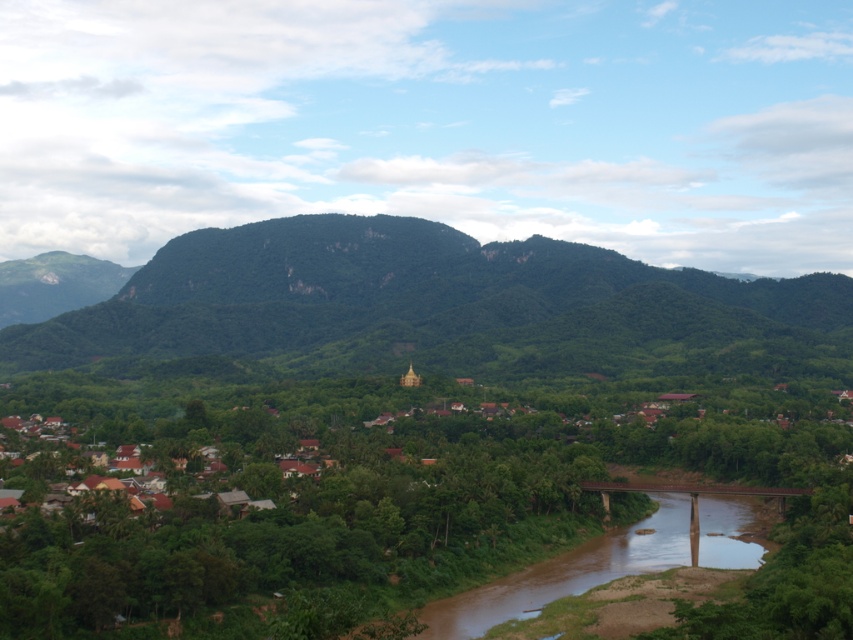
Is green forested mountain at center below brown muddy water at center?

Actually, green forested mountain at center is above brown muddy water at center.

This screenshot has width=853, height=640. Find the location of `green forested mountain at center`. green forested mountain at center is located at coordinates (418, 300).